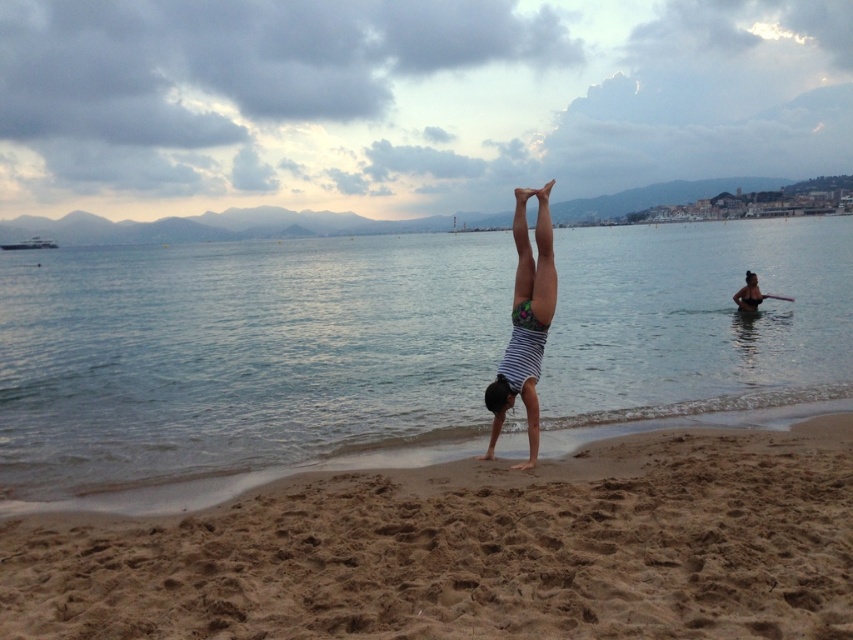
Which is behind, point (53, 284) or point (436, 465)?

Positioned behind is point (53, 284).

Which of these two, clear blue water at center or brown sandy beach at center, stands shorter?

Standing shorter between the two is brown sandy beach at center.

Who is more distant from viewer, (259, 266) or (325, 636)?

The point (259, 266) is more distant.

Where is `clear blue water at center`? The image size is (853, 640). clear blue water at center is located at coordinates (242, 358).

Which is in front, point (222, 618) or point (508, 376)?

Point (222, 618)

Which of these two, brown sandy beach at center or striped fabric person at center, stands shorter?

With less height is brown sandy beach at center.

I want to click on brown sandy beach at center, so click(473, 550).

Does clear blue water at center have a greater height compared to striped fabric person at center?

Yes, clear blue water at center is taller than striped fabric person at center.

Does clear blue water at center have a larger size compared to striped fabric person at center?

Correct, clear blue water at center is larger in size than striped fabric person at center.

Does point (165, 346) come in front of point (515, 349)?

No, (165, 346) is further to viewer.

Find the location of `clear blue water at center`. clear blue water at center is located at coordinates (242, 358).